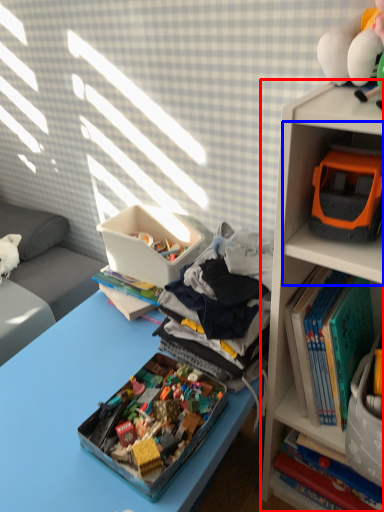
Question: Which object appears farthest to the camera in this image, bookcase (highlighted by a red box) or shelf (highlighted by a blue box)?

Choices:
 (A) bookcase
 (B) shelf

Answer: (B)